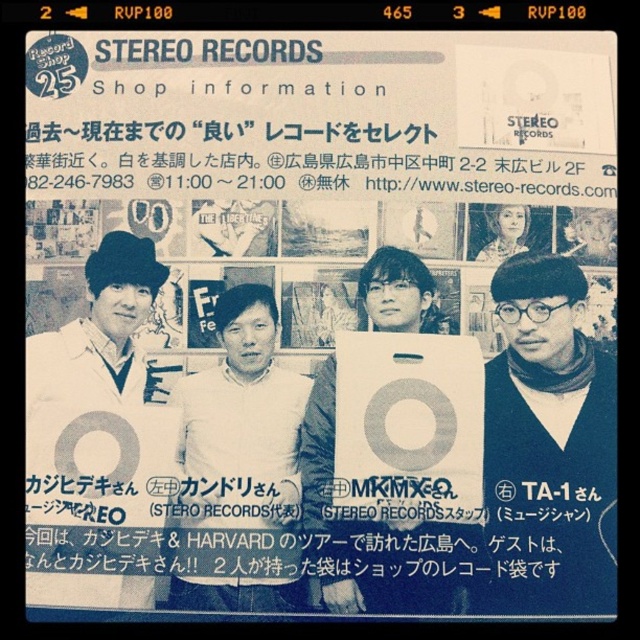
Can you confirm if white cotton shirt at center is positioned below white matte hat at upper left?

Indeed, white cotton shirt at center is positioned under white matte hat at upper left.

Describe the element at coordinates (243, 419) in the screenshot. The image size is (640, 640). I see `white cotton shirt at center` at that location.

The width and height of the screenshot is (640, 640). What are the coordinates of `white cotton shirt at center` in the screenshot? It's located at (243, 419).

Where is `white cotton shirt at center`? white cotton shirt at center is located at coordinates (243, 419).

Does white matte hat at upper left appear on the left side of white matte box at center?

Indeed, white matte hat at upper left is positioned on the left side of white matte box at center.

Consider the image. Is white matte hat at upper left thinner than white matte box at center?

Indeed, white matte hat at upper left has a lesser width compared to white matte box at center.

Locate an element on the screen. white matte hat at upper left is located at coordinates (99, 330).

Which of these two, matte black sweater at right or white matte hat at upper left, stands shorter?

white matte hat at upper left

From the picture: Can you confirm if matte black sweater at right is bigger than white matte hat at upper left?

Yes.

Between point (513, 552) and point (154, 250), which one is positioned behind?

Point (154, 250)

Where is `matte black sweater at right`? The height and width of the screenshot is (640, 640). matte black sweater at right is located at coordinates (548, 444).